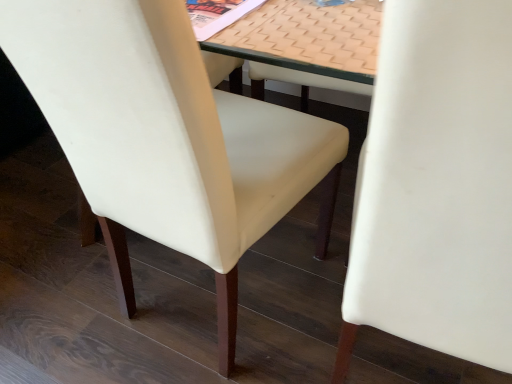
Where is `white leather chair at center, which is counted as the 2th chair, starting from the left`? white leather chair at center, which is counted as the 2th chair, starting from the left is located at coordinates (436, 186).

The image size is (512, 384). Describe the element at coordinates (436, 186) in the screenshot. I see `white leather chair at center, which is counted as the 2th chair, starting from the left` at that location.

Find the location of `beige textured mat at center`. beige textured mat at center is located at coordinates (308, 43).

I want to click on white leather chair at center, which is counted as the 2th chair, starting from the left, so click(436, 186).

Is white leather chair at center, which is counted as the 2th chair, starting from the left, at the back of beige textured mat at center?

No, beige textured mat at center is not facing away from white leather chair at center, which is counted as the 2th chair, starting from the left.

Measure the distance from beige textured mat at center to white leather chair at center, which ranks as the 1th chair in right-to-left order.

beige textured mat at center is 11.60 inches from white leather chair at center, which ranks as the 1th chair in right-to-left order.

In terms of size, does beige textured mat at center appear bigger or smaller than white leather chair at center, which ranks as the 1th chair in right-to-left order?

In the image, beige textured mat at center appears to be smaller than white leather chair at center, which ranks as the 1th chair in right-to-left order.

Considering the sizes of objects beige textured mat at center and white leather chair at center, which is counted as the 2th chair, starting from the left, in the image provided, who is taller, beige textured mat at center or white leather chair at center, which is counted as the 2th chair, starting from the left,?

white leather chair at center, which is counted as the 2th chair, starting from the left, is taller.

Is white leather chair at center, marked as the 2th chair in a right-to-left arrangement, not within beige textured mat at center?

white leather chair at center, marked as the 2th chair in a right-to-left arrangement, is positioned outside beige textured mat at center.

The image size is (512, 384). I want to click on chair that is on the left side of beige textured mat at center, so click(167, 137).

Does white leather chair at center, marked as the first chair in a left-to-right arrangement, have a larger size compared to beige textured mat at center?

Indeed, white leather chair at center, marked as the first chair in a left-to-right arrangement, has a larger size compared to beige textured mat at center.

Is white leather chair at center, marked as the 2th chair in a right-to-left arrangement, in front of or behind beige textured mat at center in the image?

white leather chair at center, marked as the 2th chair in a right-to-left arrangement, is positioned closer to the viewer than beige textured mat at center.

Based on the photo, how far apart are beige textured mat at center and white leather chair at center, marked as the 2th chair in a right-to-left arrangement?

beige textured mat at center and white leather chair at center, marked as the 2th chair in a right-to-left arrangement, are 11.07 inches apart.

Who is smaller, beige textured mat at center or white leather chair at center, marked as the first chair in a left-to-right arrangement?

Smaller between the two is beige textured mat at center.

Would you say beige textured mat at center contains white leather chair at center, marked as the 2th chair in a right-to-left arrangement?

No, beige textured mat at center does not contain white leather chair at center, marked as the 2th chair in a right-to-left arrangement.

From the image's perspective, which is above, beige textured mat at center or white leather chair at center, marked as the first chair in a left-to-right arrangement?

beige textured mat at center, from the image's perspective.

Considering the relative sizes of white leather chair at center, which ranks as the 1th chair in right-to-left order, and white leather chair at center, marked as the first chair in a left-to-right arrangement, in the image provided, is white leather chair at center, which ranks as the 1th chair in right-to-left order, taller than white leather chair at center, marked as the first chair in a left-to-right arrangement,?

Indeed, white leather chair at center, which ranks as the 1th chair in right-to-left order, has a greater height compared to white leather chair at center, marked as the first chair in a left-to-right arrangement.

Which is more to the left, white leather chair at center, which is counted as the 2th chair, starting from the left, or white leather chair at center, marked as the 2th chair in a right-to-left arrangement?

Positioned to the left is white leather chair at center, marked as the 2th chair in a right-to-left arrangement.

At what (x,y) coordinates should I click in order to perform the action: click on chair that is above the white leather chair at center, which ranks as the 1th chair in right-to-left order (from the image's perspective). Please return your answer as a coordinate pair (x, y). Image resolution: width=512 pixels, height=384 pixels. Looking at the image, I should click on (167, 137).

Could you tell me if white leather chair at center, which is counted as the 2th chair, starting from the left, is facing white leather chair at center, marked as the 2th chair in a right-to-left arrangement?

No, white leather chair at center, which is counted as the 2th chair, starting from the left, is not turned towards white leather chair at center, marked as the 2th chair in a right-to-left arrangement.

Locate an element on the screen. Image resolution: width=512 pixels, height=384 pixels. chair in front of the white leather chair at center, marked as the first chair in a left-to-right arrangement is located at coordinates (436, 186).

Is white leather chair at center, marked as the first chair in a left-to-right arrangement, thinner than white leather chair at center, which ranks as the 1th chair in right-to-left order?

Yes, white leather chair at center, marked as the first chair in a left-to-right arrangement, is thinner than white leather chair at center, which ranks as the 1th chair in right-to-left order.

From a real-world perspective, who is located higher, white leather chair at center, marked as the 2th chair in a right-to-left arrangement, or white leather chair at center, which ranks as the 1th chair in right-to-left order?

white leather chair at center, which ranks as the 1th chair in right-to-left order, is physically above.

Can you confirm if white leather chair at center, which ranks as the 1th chair in right-to-left order, is bigger than beige textured mat at center?

Correct, white leather chair at center, which ranks as the 1th chair in right-to-left order, is larger in size than beige textured mat at center.

Is the position of white leather chair at center, which ranks as the 1th chair in right-to-left order, more distant than that of beige textured mat at center?

No, white leather chair at center, which ranks as the 1th chair in right-to-left order, is closer to the camera.

Is white leather chair at center, which ranks as the 1th chair in right-to-left order, wider than beige textured mat at center?

Correct, the width of white leather chair at center, which ranks as the 1th chair in right-to-left order, exceeds that of beige textured mat at center.

In the scene shown: From a real-world perspective, does white leather chair at center, which is counted as the 2th chair, starting from the left, stand above beige textured mat at center?

Actually, white leather chair at center, which is counted as the 2th chair, starting from the left, is physically below beige textured mat at center in the real world.

From a real-world perspective, starting from the beige textured mat at center, which chair is the 1st one below it? Please provide its 2D coordinates.

[(436, 186)]

What are the coordinates of `the 1st chair in front of the beige textured mat at center` in the screenshot? It's located at (167, 137).

Considering their positions, is white leather chair at center, marked as the first chair in a left-to-right arrangement, positioned further to white leather chair at center, which is counted as the 2th chair, starting from the left, than beige textured mat at center?

Based on the image, white leather chair at center, marked as the first chair in a left-to-right arrangement, appears to be further to white leather chair at center, which is counted as the 2th chair, starting from the left.

From the image, which object appears to be nearer to beige textured mat at center, white leather chair at center, marked as the first chair in a left-to-right arrangement, or white leather chair at center, which is counted as the 2th chair, starting from the left?

white leather chair at center, marked as the first chair in a left-to-right arrangement.

Estimate the real-world distances between objects in this image. Which object is further from white leather chair at center, which is counted as the 2th chair, starting from the left, beige textured mat at center or white leather chair at center, marked as the 2th chair in a right-to-left arrangement?

Among the two, white leather chair at center, marked as the 2th chair in a right-to-left arrangement, is located further to white leather chair at center, which is counted as the 2th chair, starting from the left.

Based on their spatial positions, is beige textured mat at center or white leather chair at center, which is counted as the 2th chair, starting from the left, further from white leather chair at center, marked as the first chair in a left-to-right arrangement?

Based on the image, white leather chair at center, which is counted as the 2th chair, starting from the left, appears to be further to white leather chair at center, marked as the first chair in a left-to-right arrangement.

From the image, which object appears to be farther from beige textured mat at center, white leather chair at center, which ranks as the 1th chair in right-to-left order, or white leather chair at center, marked as the 2th chair in a right-to-left arrangement?

white leather chair at center, which ranks as the 1th chair in right-to-left order, lies further to beige textured mat at center than the other object.

Based on their spatial positions, is white leather chair at center, which ranks as the 1th chair in right-to-left order, or beige textured mat at center closer to white leather chair at center, marked as the 2th chair in a right-to-left arrangement?

beige textured mat at center.

This screenshot has width=512, height=384. What are the coordinates of `table situated between white leather chair at center, marked as the 2th chair in a right-to-left arrangement, and white leather chair at center, which is counted as the 2th chair, starting from the left, from left to right` in the screenshot? It's located at (308, 43).